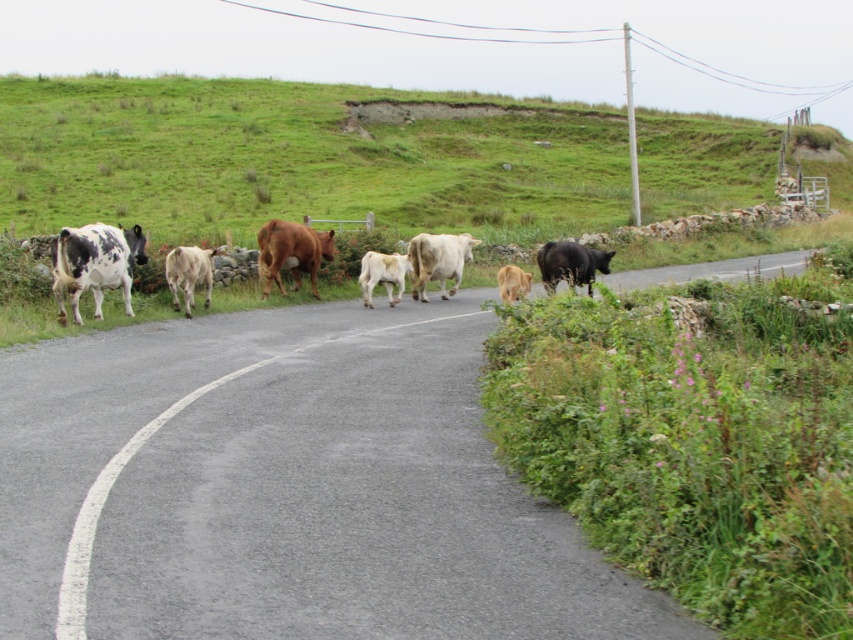
Question: Which point appears farthest from the camera in this image?

Choices:
 (A) (401, 259)
 (B) (552, 262)
 (C) (460, 120)
 (D) (173, 294)

Answer: (C)

Question: Is white and black spotted cow at center to the left of white-spotted glossy cow at left from the viewer's perspective?

Choices:
 (A) no
 (B) yes

Answer: (A)

Question: Which of these objects is positioned closest to the white smooth calf at center?

Choices:
 (A) black glossy cow at right
 (B) white-spotted glossy cow at left
 (C) green grassy hillside at upper left

Answer: (A)

Question: Can you confirm if white and black spotted cow at center is positioned above white-spotted glossy cow at left?

Choices:
 (A) yes
 (B) no

Answer: (A)

Question: Which of the following is the closest to the observer?

Choices:
 (A) (93, 280)
 (B) (397, 262)
 (C) (453, 236)

Answer: (A)

Question: Is green grassy hillside at upper left bigger than black glossy cow at right?

Choices:
 (A) no
 (B) yes

Answer: (B)